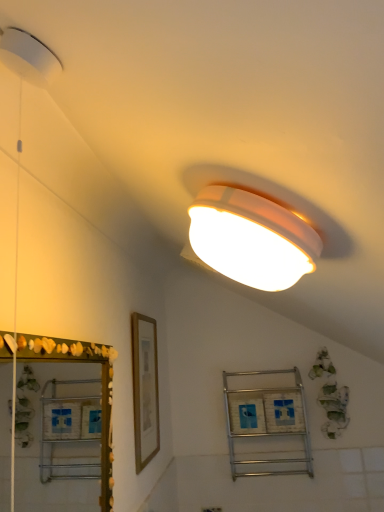
Question: Does green shell mirror at left lie in front of white plastic electric outlet at lower center?

Choices:
 (A) no
 (B) yes

Answer: (B)

Question: From a real-world perspective, is green shell mirror at left under white plastic electric outlet at lower center?

Choices:
 (A) yes
 (B) no

Answer: (B)

Question: Is the position of green shell mirror at left more distant than that of white plastic electric outlet at lower center?

Choices:
 (A) no
 (B) yes

Answer: (A)

Question: Is green shell mirror at left positioned far away from white plastic electric outlet at lower center?

Choices:
 (A) yes
 (B) no

Answer: (B)

Question: Does green shell mirror at left appear on the left side of white plastic electric outlet at lower center?

Choices:
 (A) yes
 (B) no

Answer: (A)

Question: Is green shell mirror at left taller or shorter than gold wooden picture frame at center-left?

Choices:
 (A) short
 (B) tall

Answer: (A)

Question: Does point (6, 364) appear closer or farther from the camera than point (152, 400)?

Choices:
 (A) farther
 (B) closer

Answer: (B)

Question: Would you say green shell mirror at left is inside or outside gold wooden picture frame at center-left?

Choices:
 (A) outside
 (B) inside

Answer: (A)

Question: From a real-world perspective, is green shell mirror at left physically located above or below gold wooden picture frame at center-left?

Choices:
 (A) below
 (B) above

Answer: (A)

Question: From the image's perspective, is white plastic electric outlet at lower center above or below gold wooden picture frame at center-left?

Choices:
 (A) below
 (B) above

Answer: (A)

Question: Considering the relative positions of white plastic electric outlet at lower center and gold wooden picture frame at center-left in the image provided, is white plastic electric outlet at lower center to the left or to the right of gold wooden picture frame at center-left?

Choices:
 (A) right
 (B) left

Answer: (A)

Question: In terms of height, does white plastic electric outlet at lower center look taller or shorter compared to gold wooden picture frame at center-left?

Choices:
 (A) short
 (B) tall

Answer: (A)

Question: Based on their sizes in the image, would you say white plastic electric outlet at lower center is bigger or smaller than gold wooden picture frame at center-left?

Choices:
 (A) small
 (B) big

Answer: (A)

Question: From a real-world perspective, is metallic silver shelf at center positioned above or below gold wooden picture frame at center-left?

Choices:
 (A) below
 (B) above

Answer: (A)

Question: From the image's perspective, is metallic silver shelf at center above or below gold wooden picture frame at center-left?

Choices:
 (A) above
 (B) below

Answer: (B)